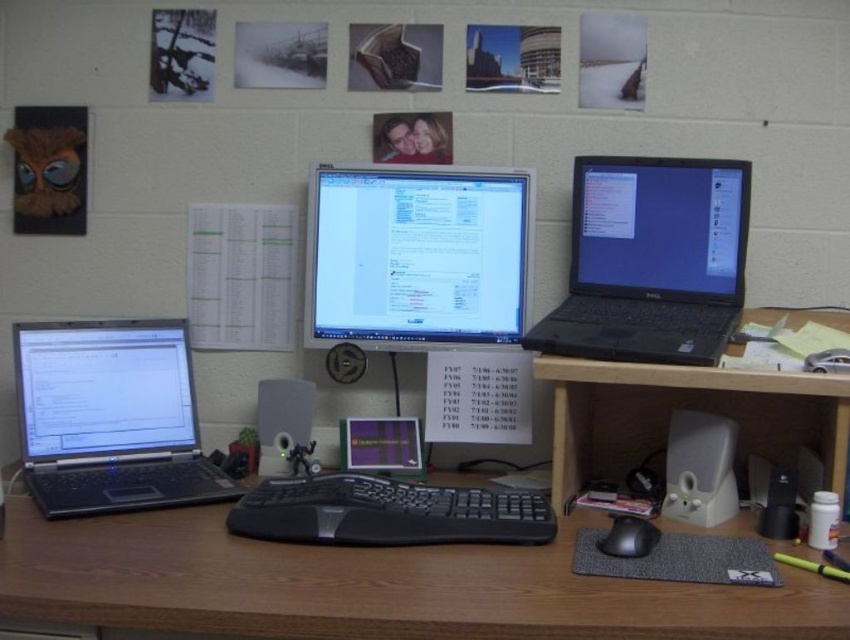
You are a delivery person who needs to place a small package between the matte black monitor at center and the camera. The package requires at least 1.5 meters of space to fit. Can you place it there?

The distance between the matte black monitor at center and the camera is 1.46 meters, which is less than the required 1.5 meters. Therefore, the package cannot be placed there.